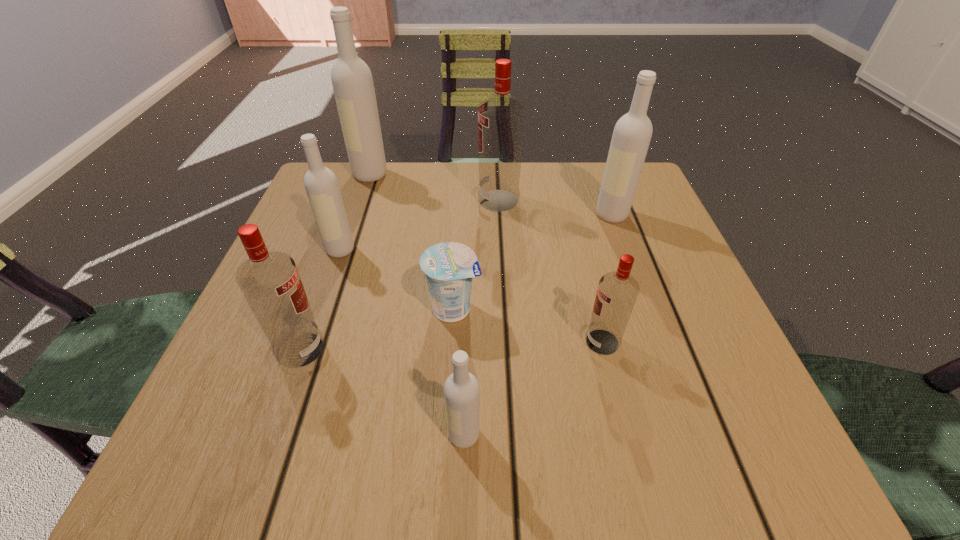
Where is `the sixth vodka from left to right`? This screenshot has width=960, height=540. the sixth vodka from left to right is located at coordinates (617, 292).

Identify the location of the smallest white vodka. The image size is (960, 540). (461, 389).

Locate an element on the screen. the nearest white vodka is located at coordinates (461, 389).

You are a GUI agent. You are given a task and a screenshot of the screen. Output one action in this format:
    pyautogui.click(x=<x>, y=<y>)
    Task: Click on the shortest object
    The image size is (960, 540).
    Given the screenshot: What is the action you would take?
    click(x=449, y=267)

The image size is (960, 540). Identify the location of blue yogurt. (449, 267).

Identify the location of free space located 0.290m on the right of the tallest object. (507, 174).

Locate an element on the screen. The height and width of the screenshot is (540, 960). vacant region located 0.360m on the front label of the second red vodka from left to right is located at coordinates (319, 200).

You are a GUI agent. You are given a task and a screenshot of the screen. Output one action in this format:
    pyautogui.click(x=<x>, y=<y>)
    Task: Click on the free spot located on the front label of the second red vodka from left to right
    
    Given the screenshot: What is the action you would take?
    pyautogui.click(x=438, y=200)

Where is `vacant position located on the front label of the second red vodka from left to right`? vacant position located on the front label of the second red vodka from left to right is located at coordinates (451, 200).

Find the location of a particular element. Image resolution: width=960 pixels, height=540 pixels. vacant space located 0.090m on the back of the rightmost white vodka is located at coordinates (601, 184).